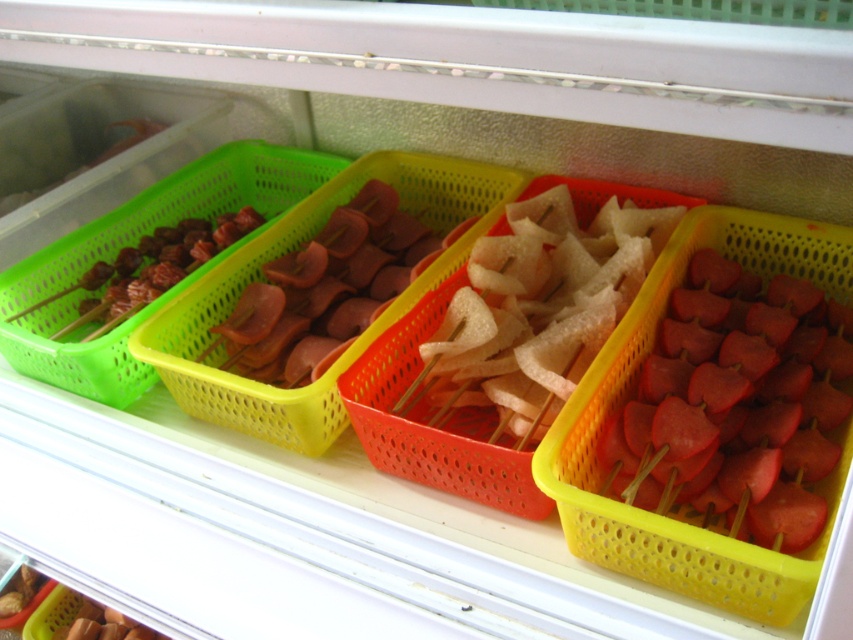
Where is `green plastic skewers at left`? Image resolution: width=853 pixels, height=640 pixels. green plastic skewers at left is located at coordinates (134, 244).

Does green plastic skewers at left have a larger size compared to pink glossy sausages at center?

Yes.

Locate an element on the screen. The width and height of the screenshot is (853, 640). green plastic skewers at left is located at coordinates (134, 244).

The height and width of the screenshot is (640, 853). I want to click on green plastic skewers at left, so click(134, 244).

Who is more distant from viewer, (x=779, y=472) or (x=120, y=316)?

The point (x=120, y=316) is more distant.

Can you confirm if red matte skewers at right is wider than matte brown skewers at left?

Correct, the width of red matte skewers at right exceeds that of matte brown skewers at left.

Who is more forward, [718,369] or [252,211]?

Point [718,369] is in front.

Where is `red matte skewers at right`? This screenshot has height=640, width=853. red matte skewers at right is located at coordinates (737, 404).

Does green plastic skewers at left appear over matte brown skewers at left?

Correct, green plastic skewers at left is located above matte brown skewers at left.

Between green plastic skewers at left and matte brown skewers at left, which one has less height?

matte brown skewers at left is shorter.

Between point (80, 355) and point (97, 285), which one is positioned behind?

Positioned behind is point (97, 285).

I want to click on green plastic skewers at left, so click(134, 244).